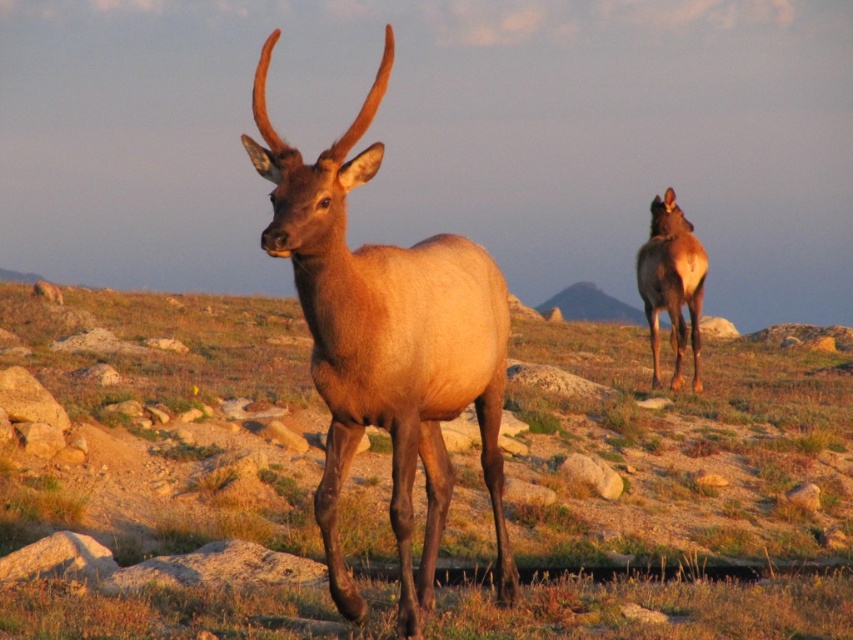
You are a photographer planning to capture a wide shot of the scene with both the brown matte grass at center and the shiny brown deer at center in the frame. Which object is wider so that you can adjust your camera angle accordingly?

The brown matte grass at center is wider than the shiny brown deer at center, so you should adjust your camera angle to accommodate its greater width.

You are an animal photographer planning to capture the brown velvet deer at right and the brown matte grass at center in a single frame. Based on their widths, which one should you focus on to ensure both fit in the frame without cropping?

The brown matte grass at center is wider than the brown velvet deer at right, so focusing on the grass will ensure both fit in the frame since it occupies more space.